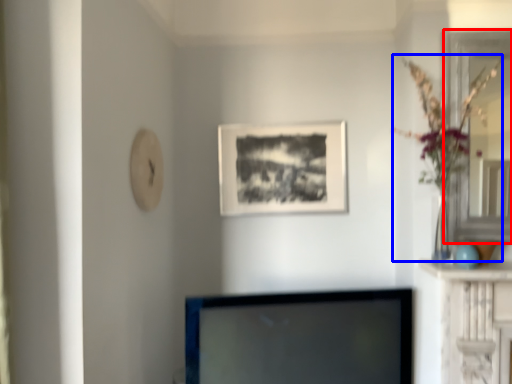
Question: Which object is further to the camera taking this photo, glass door (highlighted by a red box) or floral arrangement (highlighted by a blue box)?

Choices:
 (A) glass door
 (B) floral arrangement

Answer: (A)